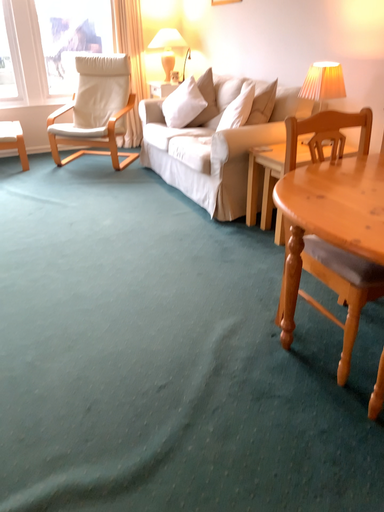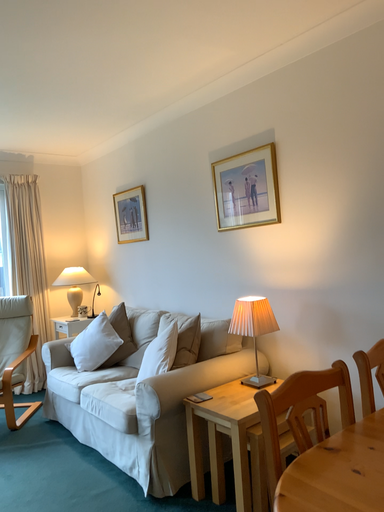
Question: How did the camera likely rotate when shooting the video?

Choices:
 (A) rotated downward
 (B) rotated upward

Answer: (B)